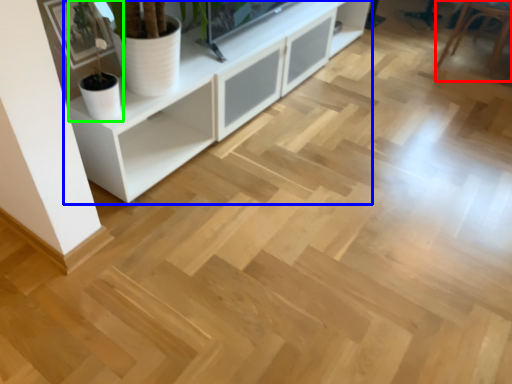
Question: Which is farther away from armchair (highlighted by a red box)? cabinetry (highlighted by a blue box) or houseplant (highlighted by a green box)?

Choices:
 (A) cabinetry
 (B) houseplant

Answer: (B)